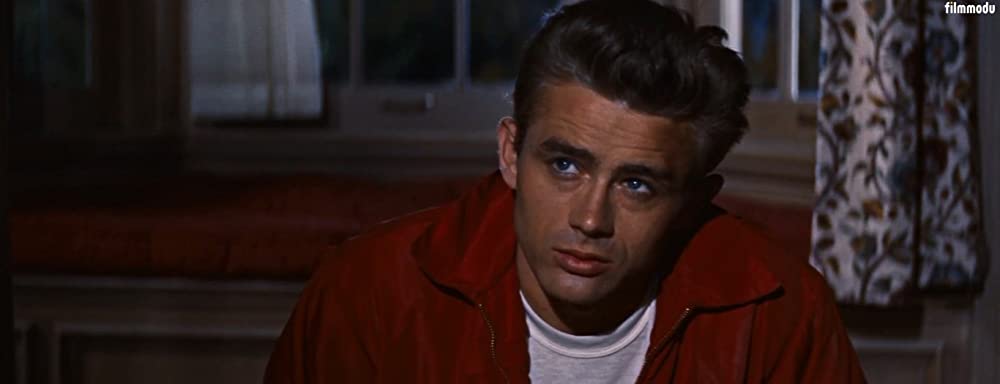
Where is `rug`? The image size is (1000, 384). rug is located at coordinates (254, 239).